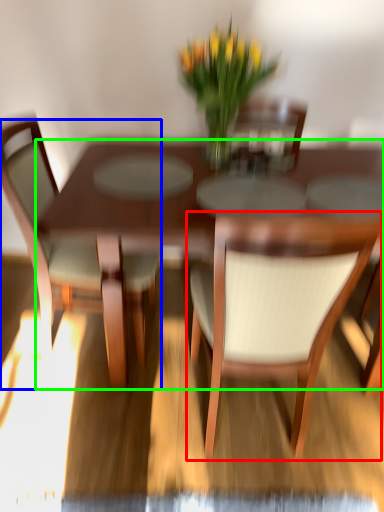
Question: Which is farther away from chair (highlighted by a red box)? chair (highlighted by a blue box) or kitchen & dining room table (highlighted by a green box)?

Choices:
 (A) chair
 (B) kitchen & dining room table

Answer: (A)